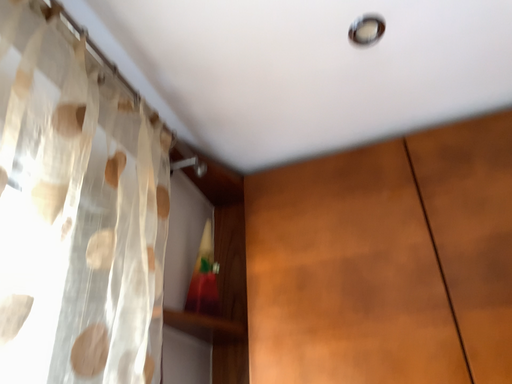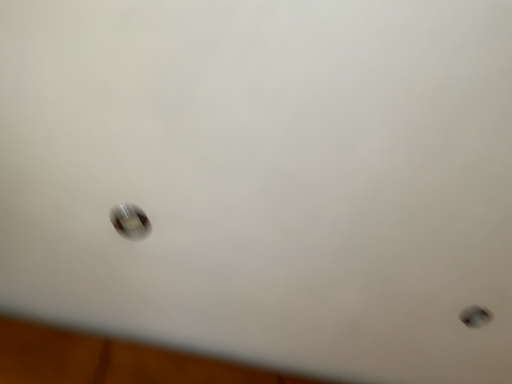
Question: Which way did the camera rotate in the video?

Choices:
 (A) rotated right
 (B) rotated left

Answer: (A)